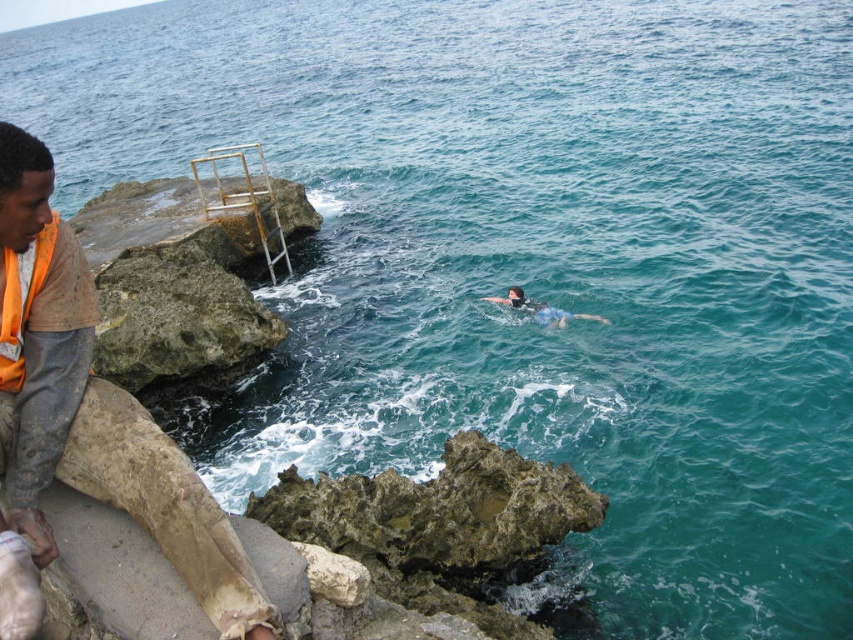
How far apart are orange fabric shirt at left and orange fabric life jacket at left?

orange fabric shirt at left is 8.20 inches from orange fabric life jacket at left.

Is the position of orange fabric shirt at left less distant than that of orange fabric life jacket at left?

Yes, orange fabric shirt at left is in front of orange fabric life jacket at left.

Does point (7, 346) come closer to viewer compared to point (22, 378)?

Yes, it is in front of point (22, 378).

In order to click on orange fabric shirt at left in this screenshot , I will do `click(38, 332)`.

Does orange fabric life jacket at left have a smaller size compared to blue rubber at center?

Indeed, orange fabric life jacket at left has a smaller size compared to blue rubber at center.

Which is more to the right, orange fabric life jacket at left or blue rubber at center?

blue rubber at center is more to the right.

This screenshot has height=640, width=853. Find the location of `orange fabric life jacket at left`. orange fabric life jacket at left is located at coordinates (21, 300).

The width and height of the screenshot is (853, 640). What do you see at coordinates (38, 332) in the screenshot?
I see `orange fabric shirt at left` at bounding box center [38, 332].

Measure the distance between point [86,304] and camera.

The distance of point [86,304] from camera is 5.57 meters.

Image resolution: width=853 pixels, height=640 pixels. I want to click on orange fabric shirt at left, so click(38, 332).